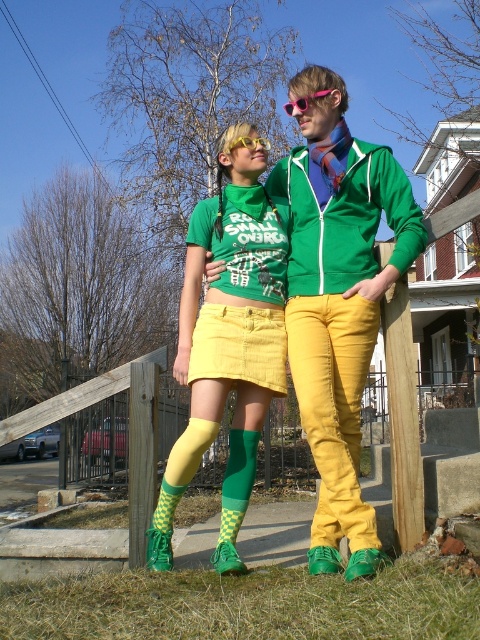
Is point (331, 282) behind point (228, 538)?

Yes, point (331, 282) is behind point (228, 538).

Which is above, matte green socks at center or green checkered sock at center?

Positioned higher is matte green socks at center.

The width and height of the screenshot is (480, 640). I want to click on matte green socks at center, so [x=338, y=300].

Can you confirm if matte green socks at center is bigger than pink plastic goggles at upper center?

No.

The image size is (480, 640). What do you see at coordinates (338, 300) in the screenshot?
I see `matte green socks at center` at bounding box center [338, 300].

This screenshot has height=640, width=480. I want to click on matte green socks at center, so click(x=338, y=300).

Does green checkered sock at center have a smaller size compared to yellow plastic goggles at upper center?

No.

Can you confirm if green checkered sock at center is thinner than yellow plastic goggles at upper center?

Indeed, green checkered sock at center has a lesser width compared to yellow plastic goggles at upper center.

I want to click on green checkered sock at center, so click(x=238, y=481).

Find the location of `green checkered sock at center`. green checkered sock at center is located at coordinates (238, 481).